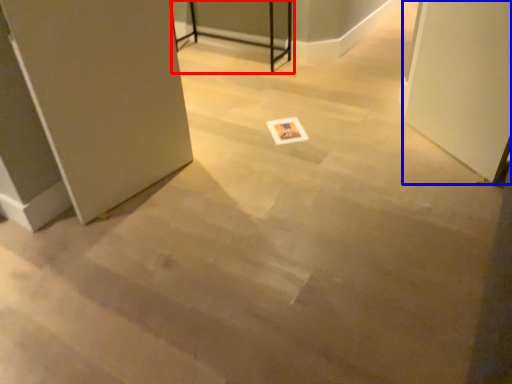
Question: Which object is closer to the camera taking this photo, table (highlighted by a red box) or screen door (highlighted by a blue box)?

Choices:
 (A) table
 (B) screen door

Answer: (B)